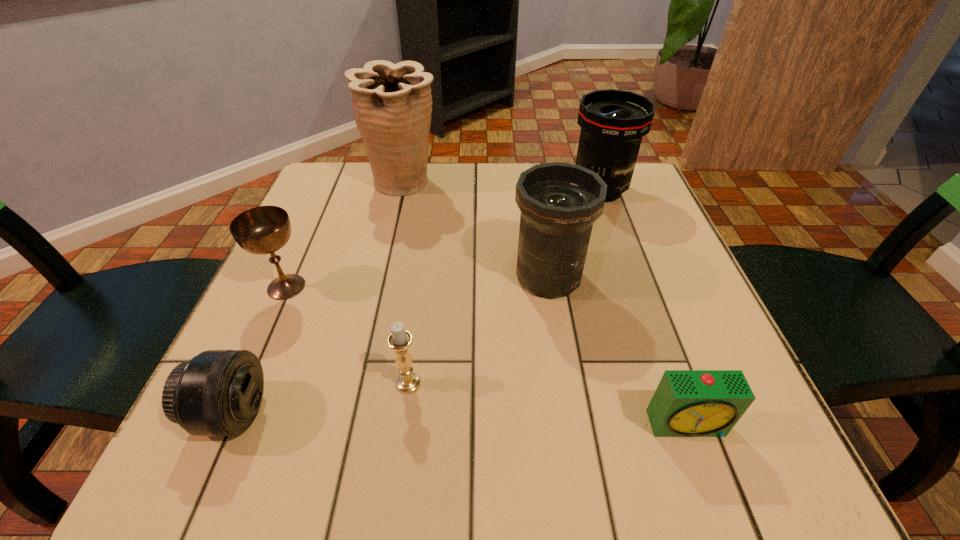
Where is `free space located on the left of the rightmost telephoto lens`? This screenshot has height=540, width=960. free space located on the left of the rightmost telephoto lens is located at coordinates (503, 190).

Find the location of a particular element. The height and width of the screenshot is (540, 960). free region located on the front of the fifth object from left to right is located at coordinates (560, 344).

Image resolution: width=960 pixels, height=540 pixels. I want to click on vacant region located 0.360m on the back of the chalice, so click(336, 176).

Find the location of a particular element. vacant area situated on the right of the candle holder is located at coordinates (490, 383).

Image resolution: width=960 pixels, height=540 pixels. What are the coordinates of `free spot located on the front-facing side of the shortest telephoto lens` in the screenshot? It's located at (505, 413).

The width and height of the screenshot is (960, 540). What are the coordinates of `urn that is at the far edge` in the screenshot? It's located at (392, 103).

Find the location of a particular element. This screenshot has height=540, width=960. telephoto lens that is at the far edge is located at coordinates (613, 122).

Identify the location of telephoto lens that is at the near edge. (218, 392).

What are the coordinates of `alarm clock located in the near edge section of the desktop` in the screenshot? It's located at (687, 403).

Identify the location of urn at the left edge. (392, 103).